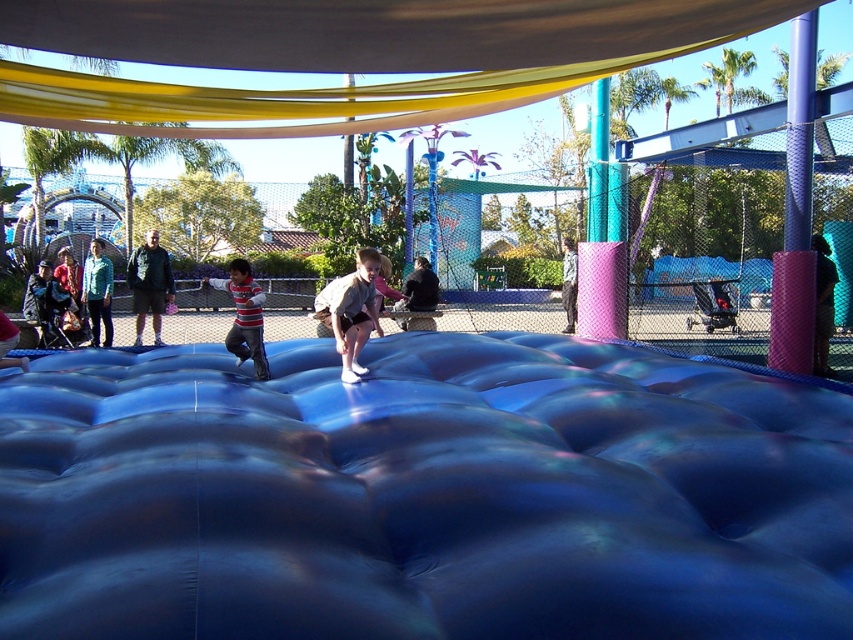
You are organizing a clothing donation drive and need to determine which item takes up more space in the donation bin. Based on the image, which item is wider between the striped cotton shirt at center and the dark green jacket at center?

The striped cotton shirt at center is wider than the dark green jacket at center, so it takes up more space in the donation bin.

You are standing in the recreational area and want to place a small toy between the blue rubberized mat at center and the matte gray shorts at center. Based on their positions, which object should the toy be closer to?

The blue rubberized mat at center is to the right of the matte gray shorts at center, so the toy should be placed closer to the matte gray shorts at center to be between them.